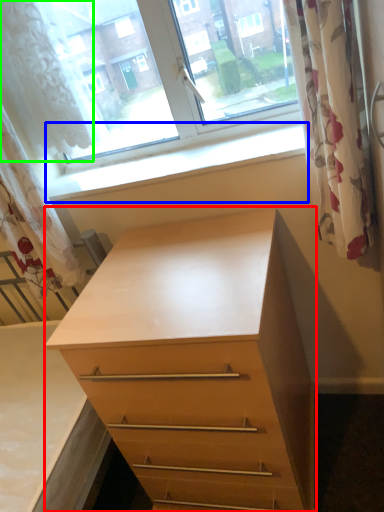
Question: Which object is positioned farthest from chest of drawers (highlighted by a red box)? Select from window sill (highlighted by a blue box) and shower curtain (highlighted by a green box).

Choices:
 (A) window sill
 (B) shower curtain

Answer: (B)